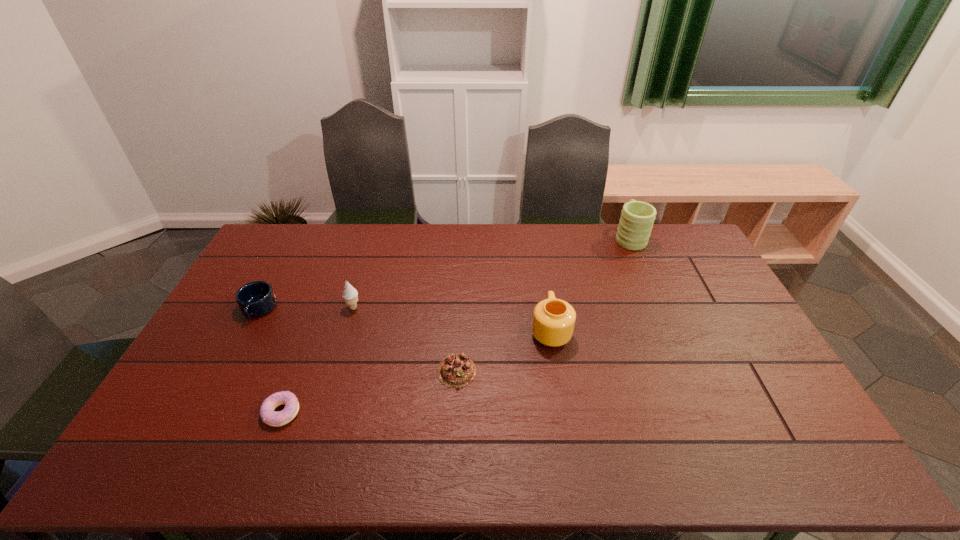
Image resolution: width=960 pixels, height=540 pixels. Identify the location of the farthest object. (637, 218).

Find the location of `the tallest mug`. the tallest mug is located at coordinates (637, 218).

Identify the location of the second mug from left to right. This screenshot has height=540, width=960. (553, 323).

Locate an element on the screen. the second object from right to left is located at coordinates (553, 323).

Where is `icecream`? The image size is (960, 540). icecream is located at coordinates click(350, 295).

This screenshot has height=540, width=960. I want to click on the leftmost object, so click(255, 299).

What are the coordinates of `the third shortest object` in the screenshot? It's located at (255, 299).

The height and width of the screenshot is (540, 960). What are the coordinates of `the fifth farthest object` in the screenshot? It's located at (456, 370).

In order to click on the fifth tallest object in this screenshot , I will do `click(456, 370)`.

The image size is (960, 540). Identify the location of the nearest object. (269, 416).